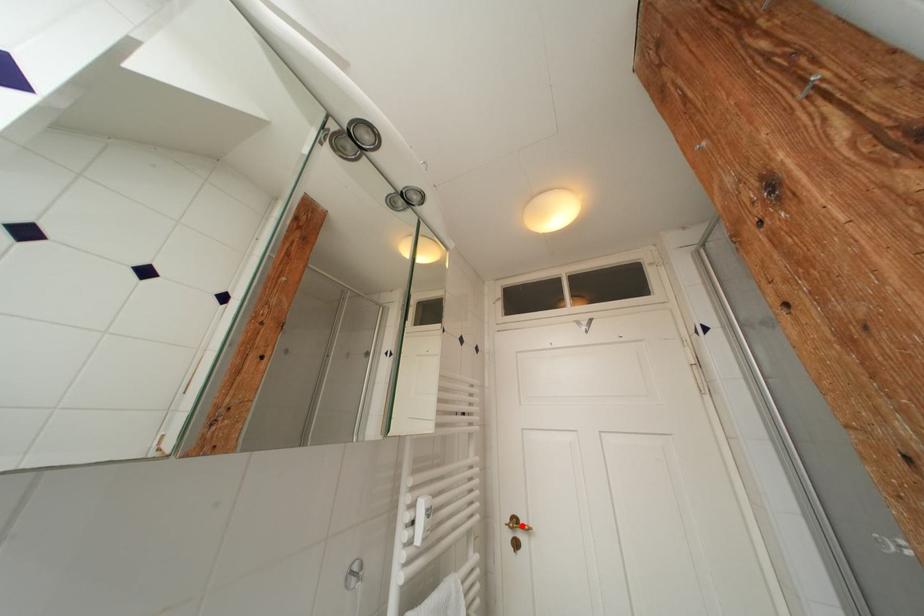
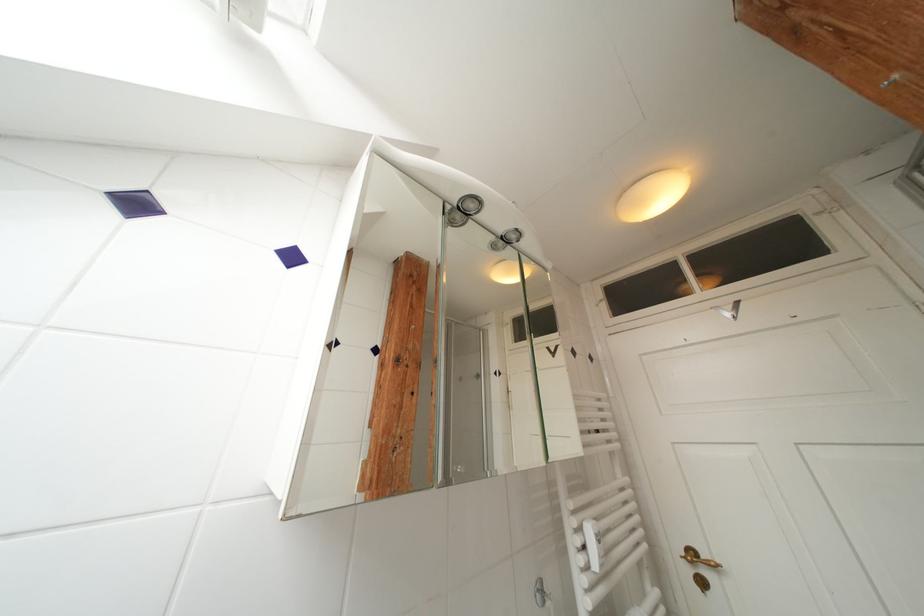
The point at the highlighted location is marked in the first image. Where is the corresponding point in the second image?

(699, 557)